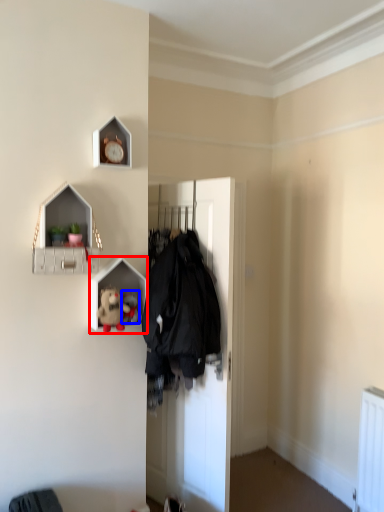
Question: Which object appears closest to the camera in this image, shelf (highlighted by a red box) or toy (highlighted by a blue box)?

Choices:
 (A) shelf
 (B) toy

Answer: (A)